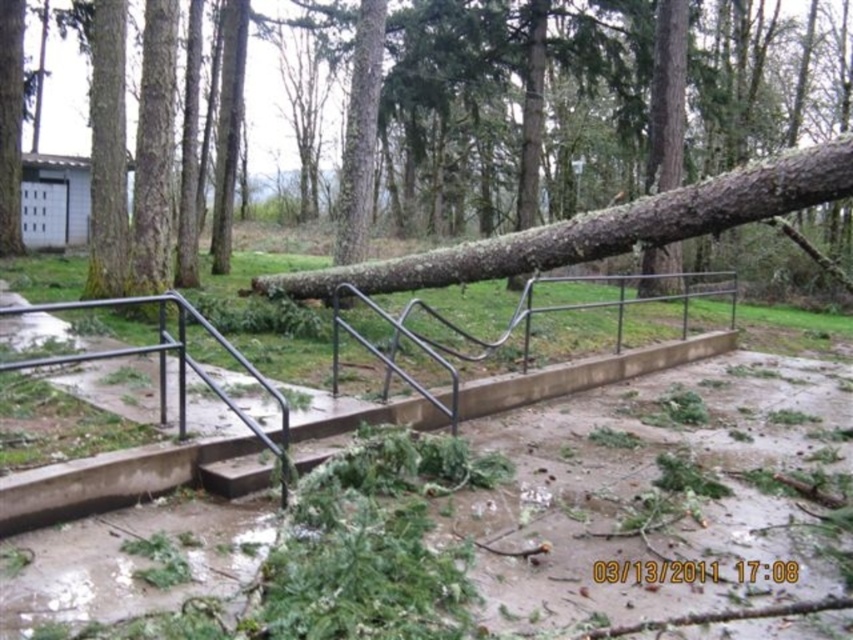
You are a park maintenance worker who needs to clear the pathway. You see the brown rough bark tree at center and the black metal rail at center. Which object is taller and needs to be addressed first for safety?

The brown rough bark tree at center is much taller than the black metal rail at center, so it should be addressed first for safety concerns.

You are a park maintenance worker who needs to clear the pathway. You see the brown rough bark tree at center and the black metal rail at center. Which object is closer to you, requiring immediate attention?

The brown rough bark tree at center is in front of the black metal rail at center, so it is closer and requires immediate attention.